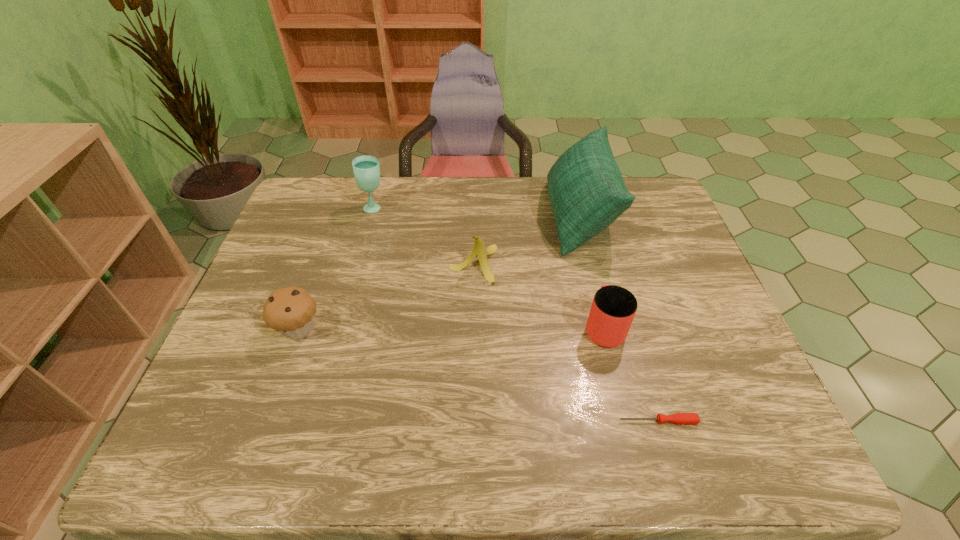
In the image, there is a desktop. Where is `free space at the far right corner`? This screenshot has height=540, width=960. free space at the far right corner is located at coordinates (647, 185).

This screenshot has height=540, width=960. I want to click on unoccupied position between the second object from left to right and the third object from left to right, so click(424, 235).

At what (x,y) coordinates should I click in order to perform the action: click on vacant area between the nearest object and the cup. Please return your answer as a coordinate pair (x, y). The image size is (960, 540). Looking at the image, I should click on (631, 374).

In order to click on free space between the cup and the cushion in this screenshot , I will do `click(591, 272)`.

Identify the location of vacant region between the banana and the cushion. (526, 240).

Identify the location of unoccupied area between the fifth object from right to left and the screwdriver. (516, 314).

Locate an element on the screen. The width and height of the screenshot is (960, 540). blank region between the tallest object and the fifth shortest object is located at coordinates (477, 212).

This screenshot has height=540, width=960. I want to click on vacant area that lies between the shortest object and the cup, so click(631, 374).

Identify the location of free spot between the muffin and the screwdriver. The image size is (960, 540). (479, 375).

Locate which object ranks in proximity to the cup. Please provide its 2D coordinates. Your answer should be formatted as a tuple, i.e. [(x, y)], where the tuple contains the x and y coordinates of a point satisfying the conditions above.

[(679, 418)]